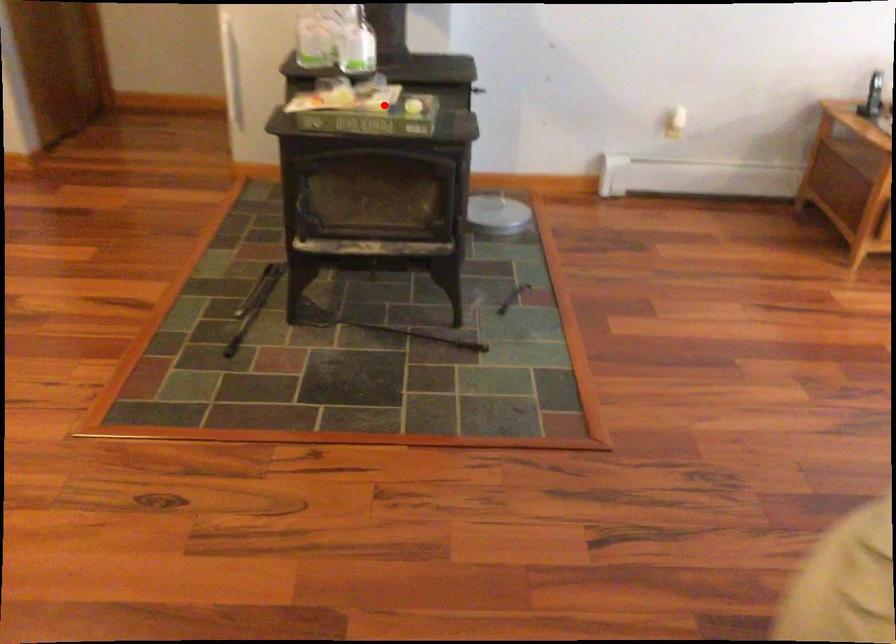
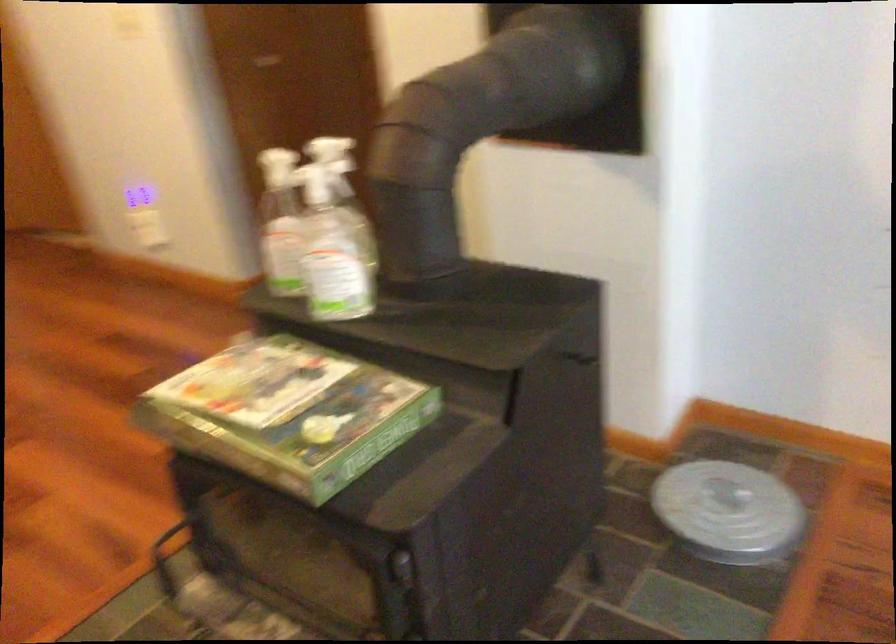
In the second image, find the point that corresponds to the highlighted location in the first image.

(289, 413)